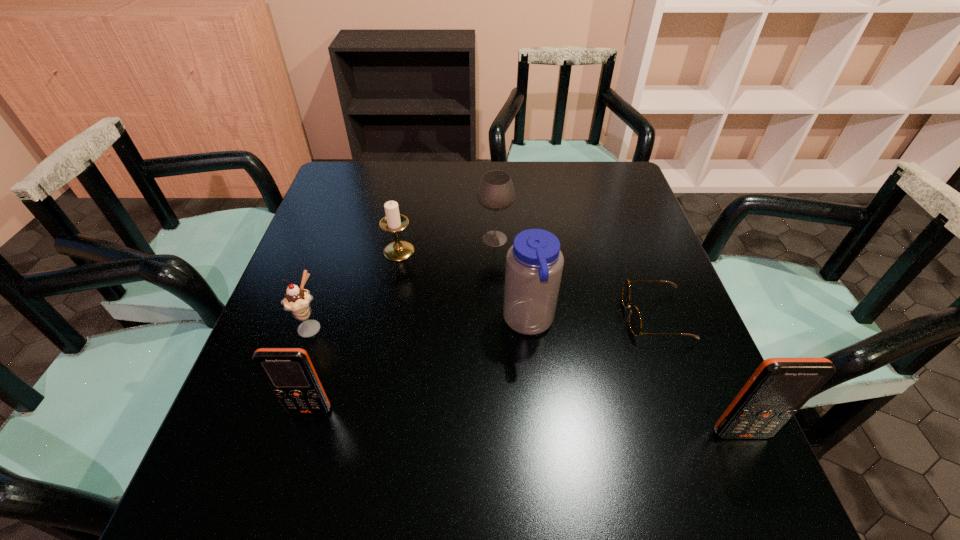
The height and width of the screenshot is (540, 960). I want to click on vacant area situated on the front of the fifth object from right to left, so click(380, 346).

The width and height of the screenshot is (960, 540). In order to click on vacant space located 0.120m on the lenses of the sunglasses in this screenshot , I will do `click(571, 316)`.

You are a GUI agent. You are given a task and a screenshot of the screen. Output one action in this format:
    pyautogui.click(x=<x>, y=<y>)
    Task: Click on the vacant space located on the lenses of the sunglasses
    
    Given the screenshot: What is the action you would take?
    pyautogui.click(x=580, y=316)

You are a GUI agent. You are given a task and a screenshot of the screen. Output one action in this format:
    pyautogui.click(x=<x>, y=<y>)
    Task: Click on the blank space located 0.250m on the lenses of the sunglasses
    The image size is (960, 540).
    Given the screenshot: What is the action you would take?
    pyautogui.click(x=513, y=316)

You are a GUI agent. You are given a task and a screenshot of the screen. Output one action in this format:
    pyautogui.click(x=<x>, y=<y>)
    Task: Click on the free point located with a carrying loop on the side of the water bottle
    The height and width of the screenshot is (540, 960).
    Given the screenshot: What is the action you would take?
    pyautogui.click(x=376, y=322)

Where is `vacant space located with a carrying loop on the side of the water bottle`? This screenshot has height=540, width=960. vacant space located with a carrying loop on the side of the water bottle is located at coordinates point(368,322).

This screenshot has height=540, width=960. I want to click on free location located with a carrying loop on the side of the water bottle, so click(395, 322).

Identify the location of free space located on the right of the icecream. The image size is (960, 540). (388, 326).

Image resolution: width=960 pixels, height=540 pixels. In order to click on cellular telephone that is at the left edge in this screenshot , I will do `click(289, 373)`.

Locate an element on the screen. icecream that is at the left edge is located at coordinates (297, 300).